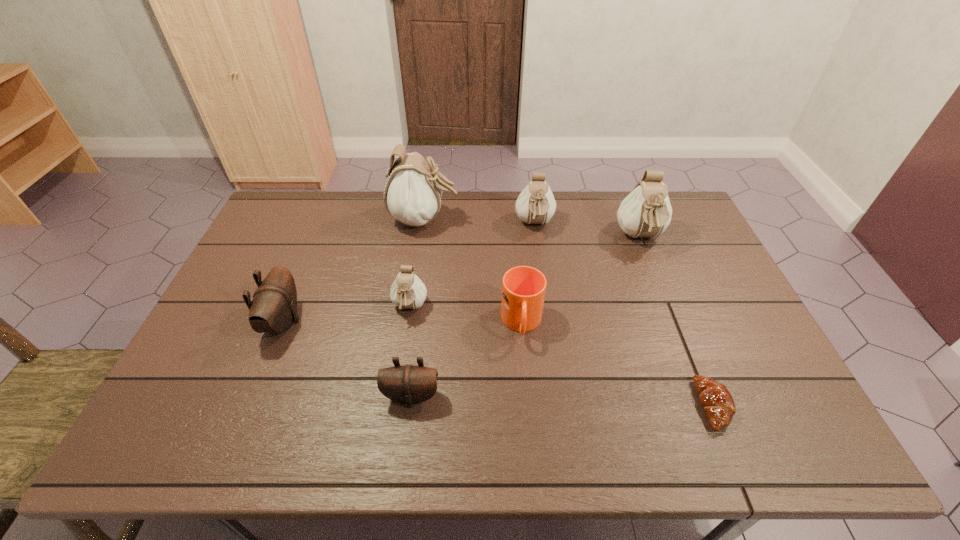
This screenshot has height=540, width=960. Find the location of `free space located on the back of the shortest object`. free space located on the back of the shortest object is located at coordinates (693, 355).

Locate an element on the screen. object that is at the near edge is located at coordinates (715, 398).

Find the location of `object located at the left edge`. object located at the left edge is located at coordinates (273, 308).

In order to click on pouch located in the right edge section of the desktop in this screenshot , I will do `click(646, 212)`.

At what (x,y) coordinates should I click in order to perform the action: click on crescent roll that is at the right edge. Please return your answer as a coordinate pair (x, y). Looking at the image, I should click on (715, 398).

Identify the location of object that is at the far right corner. The height and width of the screenshot is (540, 960). click(646, 212).

Locate an element on the screen. This screenshot has width=960, height=540. object present at the near right corner is located at coordinates (715, 398).

The width and height of the screenshot is (960, 540). I want to click on vacant region at the far edge of the desktop, so click(x=445, y=193).

Locate an element on the screen. The image size is (960, 540). free space at the near edge is located at coordinates (509, 441).

In the image, there is a desktop. Identify the location of vacant space at the left edge. This screenshot has width=960, height=540. [x=202, y=356].